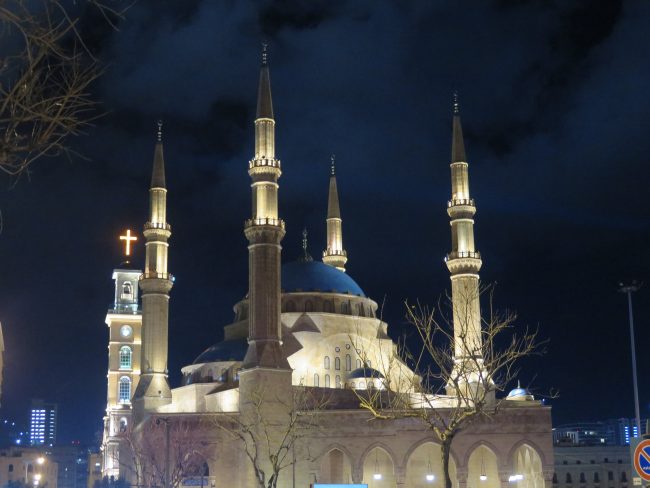
I want to click on lights, so [x=431, y=473], [x=377, y=463], [x=474, y=459], [x=515, y=474].